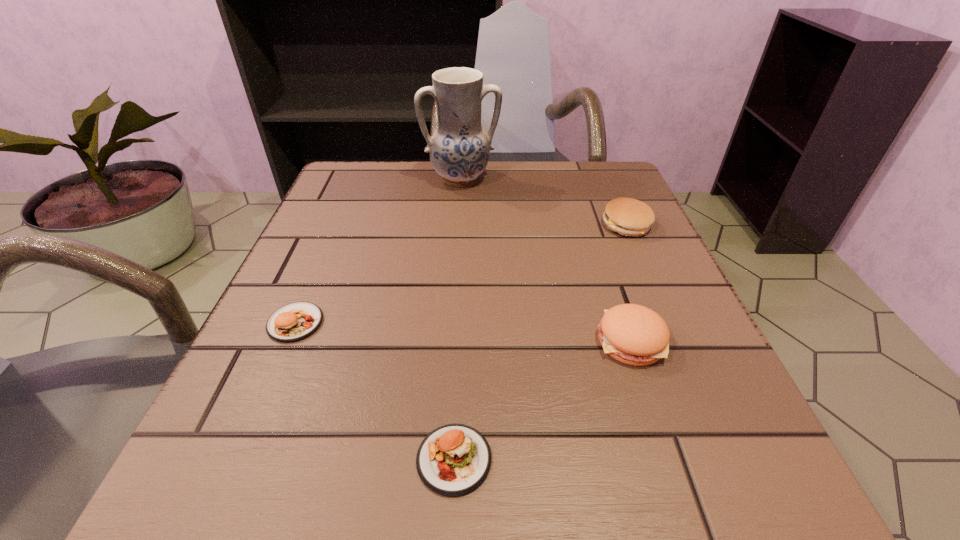
The height and width of the screenshot is (540, 960). In order to click on pottery that is positioned at the far edge in this screenshot , I will do `click(459, 149)`.

You are a GUI agent. You are given a task and a screenshot of the screen. Output one action in this format:
    pyautogui.click(x=<x>, y=<y>)
    Task: Click on the patty that is at the far edge
    
    Given the screenshot: What is the action you would take?
    pyautogui.click(x=627, y=216)

The image size is (960, 540). I want to click on object at the near edge, so click(453, 460).

Find the location of `object that is positioned at the left edge`. object that is positioned at the left edge is located at coordinates (296, 321).

I want to click on object located at the far right corner, so click(627, 216).

Image resolution: width=960 pixels, height=540 pixels. I want to click on free region at the far edge, so click(x=470, y=211).

Locate an element on the screen. vacant space at the near edge of the desktop is located at coordinates (591, 520).

Locate an element on the screen. The width and height of the screenshot is (960, 540). free space at the left edge is located at coordinates (387, 241).

You are a GUI agent. You are given a task and a screenshot of the screen. Output one action in this format:
    pyautogui.click(x=<x>, y=<y>)
    Task: Click on the free spot at the right edge of the desktop
    
    Given the screenshot: What is the action you would take?
    pyautogui.click(x=700, y=428)

In the image, there is a desktop. Where is `vacant region at the far left corner`? vacant region at the far left corner is located at coordinates (x=404, y=184).